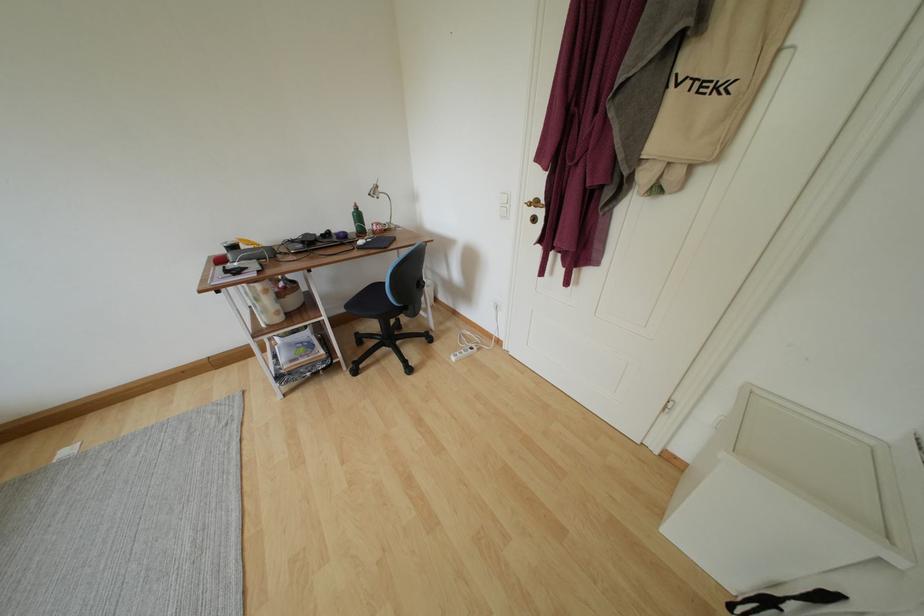
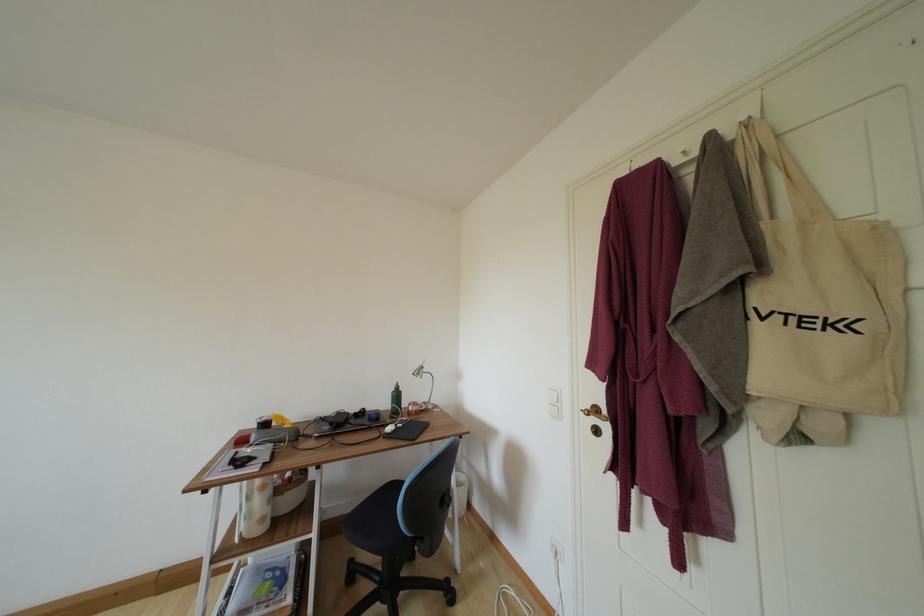
Question: The first image is from the beginning of the video and the second image is from the end. How did the camera likely rotate when shooting the video?

Choices:
 (A) Left
 (B) Right
 (C) Up
 (D) Down

Answer: (C)